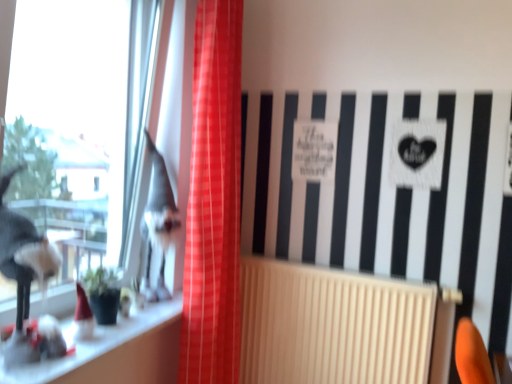
This screenshot has height=384, width=512. Find the location of `white glossy window sill at lower left`. white glossy window sill at lower left is located at coordinates (117, 352).

Is transparent glass window at left bigger or smaller than white glossy window sill at lower left?

transparent glass window at left is bigger than white glossy window sill at lower left.

In order to click on window on the left side of white glossy window sill at lower left in this screenshot , I will do `click(87, 114)`.

How many degrees apart are the facing directions of transparent glass window at left and white glossy window sill at lower left?

They differ by 0.553 degrees in their facing directions.

Is transparent glass window at left looking in the opposite direction of white glossy window sill at lower left?

transparent glass window at left does not have its back to white glossy window sill at lower left.

Which is correct: white glossy window sill at lower left is inside red plaid curtain at center, or outside of it?

white glossy window sill at lower left is not enclosed by red plaid curtain at center.

Which is more to the right, white glossy window sill at lower left or red plaid curtain at center?

red plaid curtain at center.

Is white glossy window sill at lower left turned away from red plaid curtain at center?

No, red plaid curtain at center is not at the back of white glossy window sill at lower left.

Does white glossy window sill at lower left have a greater height compared to red plaid curtain at center?

No, white glossy window sill at lower left is not taller than red plaid curtain at center.

From the image's perspective, is shiny silver figurine at left located above white glossy window sill at lower left?

Yes.

Could you tell me if shiny silver figurine at left is turned towards white glossy window sill at lower left?

No, shiny silver figurine at left is not aimed at white glossy window sill at lower left.

In terms of width, does shiny silver figurine at left look wider or thinner when compared to white glossy window sill at lower left?

In the image, shiny silver figurine at left appears to be more narrow than white glossy window sill at lower left.

From a real-world perspective, which is physically above, shiny silver figurine at left or transparent glass window at left?

From a 3D spatial view, transparent glass window at left is above.

Which object is further away from the camera taking this photo, shiny silver figurine at left or transparent glass window at left?

shiny silver figurine at left is behind.

Is shiny silver figurine at left not inside transparent glass window at left?

Actually, shiny silver figurine at left is at least partially inside transparent glass window at left.

From the image's perspective, which one is positioned lower, shiny silver figurine at left or transparent glass window at left?

shiny silver figurine at left, from the image's perspective.

From the picture: What's the angular difference between transparent glass window at left and red plaid curtain at center's facing directions?

transparent glass window at left and red plaid curtain at center are facing 1.07 degrees away from each other.

Considering the points (92, 104) and (237, 297), which point is behind, point (92, 104) or point (237, 297)?

The point (92, 104) is more distant.

From a real-world perspective, which is physically above, transparent glass window at left or red plaid curtain at center?

transparent glass window at left is physically above.

Are transparent glass window at left and red plaid curtain at center beside each other?

transparent glass window at left and red plaid curtain at center are clearly separated.

The height and width of the screenshot is (384, 512). I want to click on window in front of the red plaid curtain at center, so click(x=87, y=114).

Which of these two, red plaid curtain at center or transparent glass window at left, is wider?

red plaid curtain at center is wider.

Is red plaid curtain at center far from transparent glass window at left?

red plaid curtain at center is actually quite close to transparent glass window at left.

What's the angular difference between shiny silver figurine at left and beige ribbed radiator at center's facing directions?

The angle between the facing direction of shiny silver figurine at left and the facing direction of beige ribbed radiator at center is 91.8 degrees.

Between shiny silver figurine at left and beige ribbed radiator at center, which one appears on the right side from the viewer's perspective?

From the viewer's perspective, beige ribbed radiator at center appears more on the right side.

In the scene shown: Could beige ribbed radiator at center be considered to be inside shiny silver figurine at left?

That's incorrect, beige ribbed radiator at center is not inside shiny silver figurine at left.

Which object is closer to the camera, shiny silver figurine at left or beige ribbed radiator at center?

beige ribbed radiator at center is closer to the camera.

Locate an element on the screen. This screenshot has height=384, width=512. window above the white glossy window sill at lower left (from a real-world perspective) is located at coordinates (87, 114).

This screenshot has height=384, width=512. In order to click on window sill lying on the left of red plaid curtain at center in this screenshot , I will do `click(117, 352)`.

When comparing their distances from transparent glass window at left, does white glossy window sill at lower left or shiny silver figurine at left seem closer?

shiny silver figurine at left lies closer to transparent glass window at left than the other object.

Which object lies further to the anchor point white glossy window sill at lower left, beige ribbed radiator at center or transparent glass window at left?

beige ribbed radiator at center is further to white glossy window sill at lower left.

Based on their spatial positions, is beige ribbed radiator at center or red plaid curtain at center closer to transparent glass window at left?

red plaid curtain at center.

Which object lies nearer to the anchor point red plaid curtain at center, beige ribbed radiator at center or transparent glass window at left?

Among the two, transparent glass window at left is located nearer to red plaid curtain at center.

Estimate the real-world distances between objects in this image. Which object is closer to red plaid curtain at center, white glossy window sill at lower left or transparent glass window at left?

white glossy window sill at lower left is closer to red plaid curtain at center.

From the picture: When comparing their distances from shiny silver figurine at left, does beige ribbed radiator at center or white glossy window sill at lower left seem closer?

white glossy window sill at lower left is closer to shiny silver figurine at left.

Considering their positions, is white glossy window sill at lower left positioned further to red plaid curtain at center than shiny silver figurine at left?

white glossy window sill at lower left lies further to red plaid curtain at center than the other object.

Consider the image. Which object lies nearer to the anchor point beige ribbed radiator at center, red plaid curtain at center or white glossy window sill at lower left?

Based on the image, red plaid curtain at center appears to be nearer to beige ribbed radiator at center.

Find the location of a particular element. curtain between transparent glass window at left and beige ribbed radiator at center is located at coordinates (214, 201).

Locate an element on the screen. This screenshot has width=512, height=384. curtain positioned between transparent glass window at left and shiny silver figurine at left from near to far is located at coordinates (214, 201).

Find the location of a particular element. This screenshot has width=512, height=384. animal between white glossy window sill at lower left and beige ribbed radiator at center in the horizontal direction is located at coordinates (158, 222).

Where is `window sill between transparent glass window at left and beige ribbed radiator at center from left to right`? Image resolution: width=512 pixels, height=384 pixels. window sill between transparent glass window at left and beige ribbed radiator at center from left to right is located at coordinates (117, 352).